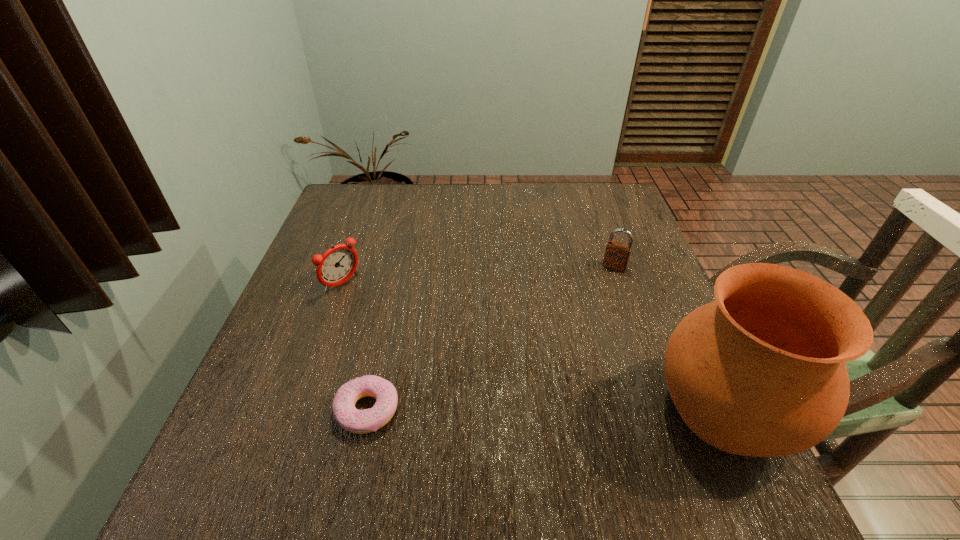
The image size is (960, 540). I want to click on free spot located on the front-facing side of the leftmost object, so click(x=404, y=332).

The image size is (960, 540). Identify the location of vacant position located on the front-facing side of the leftmost object. (423, 346).

This screenshot has height=540, width=960. I want to click on vacant space situated on the front-facing side of the leftmost object, so click(426, 349).

Locate an element on the screen. Image resolution: width=960 pixels, height=540 pixels. doughnut that is at the near edge is located at coordinates (356, 421).

I want to click on pottery that is at the near edge, so click(760, 371).

I want to click on object at the left edge, so click(336, 266).

I want to click on pottery present at the right edge, so click(x=760, y=371).

Find the location of a particular element. padlock that is at the right edge is located at coordinates (617, 255).

Locate an element on the screen. object located at the near right corner is located at coordinates (760, 371).

Locate an element on the screen. blank space at the far edge of the desktop is located at coordinates (517, 208).